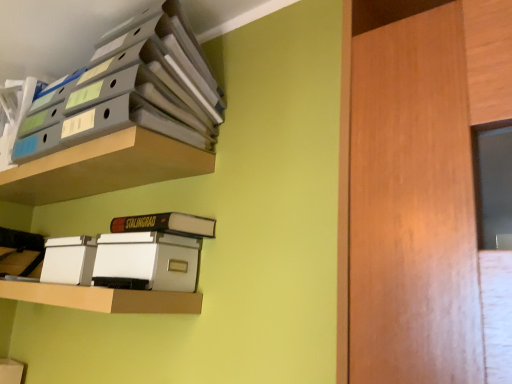
Where is `matte gray folders at upper left, the third shelf from the bottom`? The width and height of the screenshot is (512, 384). matte gray folders at upper left, the third shelf from the bottom is located at coordinates (127, 117).

What is the approximate height of white cardboard shelf at lower center, marked as the 1th shelf in a bottom-to-top arrangement?

white cardboard shelf at lower center, marked as the 1th shelf in a bottom-to-top arrangement, is 3.12 inches tall.

This screenshot has width=512, height=384. What do you see at coordinates (103, 298) in the screenshot?
I see `white cardboard shelf at lower center, marked as the 1th shelf in a bottom-to-top arrangement` at bounding box center [103, 298].

Describe the element at coordinates (103, 167) in the screenshot. The width and height of the screenshot is (512, 384). I see `matte plastic shelf at upper left, the 2th shelf viewed from the top` at that location.

Image resolution: width=512 pixels, height=384 pixels. I want to click on hardcover book at center, so click(x=166, y=224).

Is white plastic storage box at lower left positioned with its back to matte gray folders at upper left, the third shelf from the bottom?

No, white plastic storage box at lower left's orientation is not away from matte gray folders at upper left, the third shelf from the bottom.

Can you confirm if white plastic storage box at lower left is smaller than matte gray folders at upper left, the 1th shelf in the top-to-bottom sequence?

Yes, white plastic storage box at lower left is smaller than matte gray folders at upper left, the 1th shelf in the top-to-bottom sequence.

Which of these two, white plastic storage box at lower left or matte gray folders at upper left, the third shelf from the bottom, is wider?

matte gray folders at upper left, the third shelf from the bottom.

Does white plastic storage box at lower left have a greater height compared to matte gray folders at upper left, the third shelf from the bottom?

No, white plastic storage box at lower left is not taller than matte gray folders at upper left, the third shelf from the bottom.

Considering the positions of points (85, 286) and (202, 236), is point (85, 286) farther from camera compared to point (202, 236)?

No, (85, 286) is closer to viewer.

Is white cardboard shelf at lower center, marked as the 1th shelf in a bottom-to-top arrangement, touching hardcover book at center?

white cardboard shelf at lower center, marked as the 1th shelf in a bottom-to-top arrangement, and hardcover book at center are not in contact.

Which of these two, white cardboard shelf at lower center, marked as the 1th shelf in a bottom-to-top arrangement, or hardcover book at center, is thinner?

Thinner between the two is hardcover book at center.

From a real-world perspective, relative to hardcover book at center, is white cardboard shelf at lower center, marked as the 1th shelf in a bottom-to-top arrangement, vertically above or below?

Clearly, from a real-world perspective, white cardboard shelf at lower center, marked as the 1th shelf in a bottom-to-top arrangement, is below hardcover book at center.

Where is `the 1st shelf counting from the left of the matte gray folders at upper left, the 1th shelf in the top-to-bottom sequence`? the 1st shelf counting from the left of the matte gray folders at upper left, the 1th shelf in the top-to-bottom sequence is located at coordinates (103, 167).

Considering the sizes of objects matte gray folders at upper left, the third shelf from the bottom, and matte plastic shelf at upper left, the 2th shelf viewed from the top, in the image provided, who is smaller, matte gray folders at upper left, the third shelf from the bottom, or matte plastic shelf at upper left, the 2th shelf viewed from the top,?

With smaller size is matte plastic shelf at upper left, the 2th shelf viewed from the top.

Is matte plastic shelf at upper left, which ranks as the second shelf in bottom-to-top order, located within matte gray folders at upper left, the third shelf from the bottom?

No.

From the image's perspective, which object appears higher, matte gray folders at upper left, the third shelf from the bottom, or matte plastic shelf at upper left, the 2th shelf viewed from the top?

matte gray folders at upper left, the third shelf from the bottom.

Considering the sizes of objects hardcover book at center and white plastic storage box at lower left in the image provided, who is thinner, hardcover book at center or white plastic storage box at lower left?

white plastic storage box at lower left is thinner.

From a real-world perspective, is hardcover book at center physically located above or below white plastic storage box at lower left?

hardcover book at center is above white plastic storage box at lower left.

Is point (147, 226) in front of point (67, 242)?

Yes.

Which object is further away from the camera, hardcover book at center or matte plastic shelf at upper left, the 2th shelf viewed from the top?

hardcover book at center is further from the camera.

From a real-world perspective, is hardcover book at center located beneath matte plastic shelf at upper left, the 2th shelf viewed from the top?

Yes, from a real-world perspective, hardcover book at center is under matte plastic shelf at upper left, the 2th shelf viewed from the top.

Can you confirm if hardcover book at center is bigger than matte plastic shelf at upper left, which ranks as the second shelf in bottom-to-top order?

Answer: No, hardcover book at center is not bigger than matte plastic shelf at upper left, which ranks as the second shelf in bottom-to-top order.

How many degrees apart are the facing directions of matte plastic shelf at upper left, the 2th shelf viewed from the top, and hardcover book at center?

1.48 degrees.

From a real-world perspective, which is physically below, matte plastic shelf at upper left, which ranks as the second shelf in bottom-to-top order, or hardcover book at center?

In real-world perspective, hardcover book at center is lower.

Considering the sizes of matte plastic shelf at upper left, the 2th shelf viewed from the top, and hardcover book at center in the image, is matte plastic shelf at upper left, the 2th shelf viewed from the top, wider or thinner than hardcover book at center?

Clearly, matte plastic shelf at upper left, the 2th shelf viewed from the top, has more width compared to hardcover book at center.

Is hardcover book at center inside matte plastic shelf at upper left, which ranks as the second shelf in bottom-to-top order?

No, hardcover book at center is not surrounded by matte plastic shelf at upper left, which ranks as the second shelf in bottom-to-top order.

Is matte gray folders at upper left, the 1th shelf in the top-to-bottom sequence, to the right of hardcover book at center from the viewer's perspective?

Incorrect, matte gray folders at upper left, the 1th shelf in the top-to-bottom sequence, is not on the right side of hardcover book at center.

Considering the sizes of objects matte gray folders at upper left, the third shelf from the bottom, and hardcover book at center in the image provided, who is wider, matte gray folders at upper left, the third shelf from the bottom, or hardcover book at center?

matte gray folders at upper left, the third shelf from the bottom, is wider.

Based on the photo, is matte gray folders at upper left, the third shelf from the bottom, touching hardcover book at center?

matte gray folders at upper left, the third shelf from the bottom, is not next to hardcover book at center, and they're not touching.

From the image's perspective, does matte gray folders at upper left, the 1th shelf in the top-to-bottom sequence, appear lower than hardcover book at center?

No.

From the image's perspective, count 2nd shelfs upward from the white plastic storage box at lower left and point to it. Please provide its 2D coordinates.

[(127, 117)]

Find the location of a particular element. This screenshot has width=512, height=384. the 3rd shelf in front when counting from the hardcover book at center is located at coordinates (103, 298).

Which object lies further to the anchor point matte plastic shelf at upper left, the 2th shelf viewed from the top, white plastic storage box at lower left or matte gray folders at upper left, the 1th shelf in the top-to-bottom sequence?

white plastic storage box at lower left is positioned further to the anchor matte plastic shelf at upper left, the 2th shelf viewed from the top.

When comparing their distances from matte gray folders at upper left, the third shelf from the bottom, does matte plastic shelf at upper left, the 2th shelf viewed from the top, or white plastic storage box at lower left seem closer?

matte plastic shelf at upper left, the 2th shelf viewed from the top.

Considering their positions, is matte plastic shelf at upper left, which ranks as the second shelf in bottom-to-top order, positioned further to matte gray folders at upper left, the 1th shelf in the top-to-bottom sequence, than hardcover book at center?

hardcover book at center lies further to matte gray folders at upper left, the 1th shelf in the top-to-bottom sequence, than the other object.

From the image, which object appears to be farther from white plastic storage box at lower left, hardcover book at center or white cardboard shelf at lower center, marked as the 1th shelf in a bottom-to-top arrangement?

hardcover book at center.

Looking at the image, which one is located closer to matte gray folders at upper left, the third shelf from the bottom, white cardboard shelf at lower center, acting as the 3th shelf starting from the top, or hardcover book at center?

Based on the image, hardcover book at center appears to be nearer to matte gray folders at upper left, the third shelf from the bottom.

Which object lies nearer to the anchor point matte gray folders at upper left, the 1th shelf in the top-to-bottom sequence, hardcover book at center or matte plastic shelf at upper left, which ranks as the second shelf in bottom-to-top order?

matte plastic shelf at upper left, which ranks as the second shelf in bottom-to-top order.

Considering their positions, is matte plastic shelf at upper left, the 2th shelf viewed from the top, positioned closer to white plastic storage box at lower left than hardcover book at center?

Based on the image, hardcover book at center appears to be nearer to white plastic storage box at lower left.

Estimate the real-world distances between objects in this image. Which object is further from matte plastic shelf at upper left, which ranks as the second shelf in bottom-to-top order, hardcover book at center or white cardboard shelf at lower center, acting as the 3th shelf starting from the top?

white cardboard shelf at lower center, acting as the 3th shelf starting from the top, is positioned further to the anchor matte plastic shelf at upper left, which ranks as the second shelf in bottom-to-top order.

You are a GUI agent. You are given a task and a screenshot of the screen. Output one action in this format:
    pyautogui.click(x=<x>, y=<y>)
    Task: Click on the shelf that lies between matte gray folders at upper left, the 1th shelf in the top-to-bottom sequence, and white plastic storage box at lower left from top to bottom
    This screenshot has height=384, width=512.
    Given the screenshot: What is the action you would take?
    pyautogui.click(x=103, y=167)

What are the coordinates of `storage box between white cardboard shelf at lower center, marked as the 1th shelf in a bottom-to-top arrangement, and hardcover book at center` in the screenshot? It's located at (69, 260).

Identify the location of paperback book that lies between matte gray folders at upper left, the third shelf from the bottom, and white plastic storage box at lower left from top to bottom. The image size is (512, 384). (166, 224).

Where is `storage box located between matte plastic shelf at upper left, the 2th shelf viewed from the top, and hardcover book at center in the left-right direction`? The height and width of the screenshot is (384, 512). storage box located between matte plastic shelf at upper left, the 2th shelf viewed from the top, and hardcover book at center in the left-right direction is located at coordinates (69, 260).